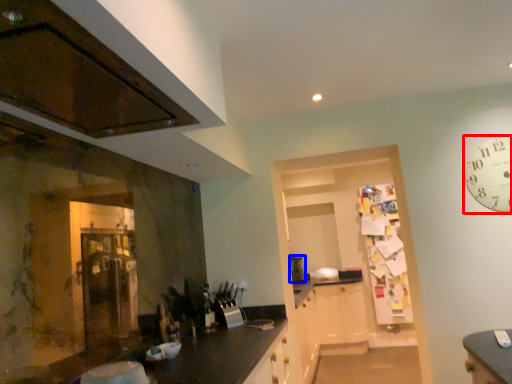
Question: Among these objects, which one is nearest to the camera, clock (highlighted by a red box) or appliance (highlighted by a blue box)?

Choices:
 (A) clock
 (B) appliance

Answer: (A)